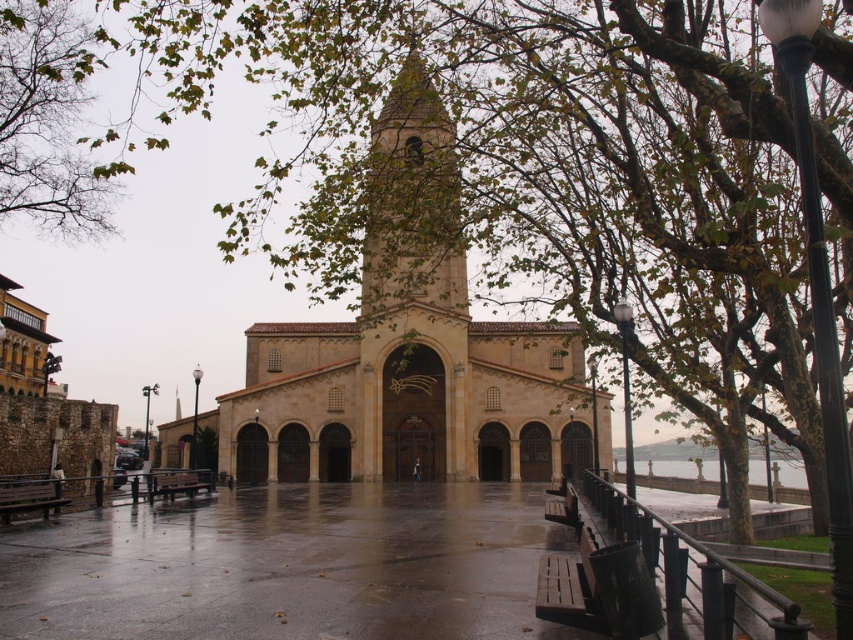
Does green leafy branches at upper left have a greater width compared to brown wooden bench at lower left?

Yes.

Is point (54, 35) in front of point (136, 480)?

No, (54, 35) is further to viewer.

Locate an element on the screen. green leafy branches at upper left is located at coordinates (47, 118).

Does wooden park bench at lower right have a lesser width compared to brown wooden bench at lower left?

Correct, wooden park bench at lower right's width is less than brown wooden bench at lower left's.

Does wooden park bench at lower right appear on the right side of brown wooden bench at lower left?

Correct, you'll find wooden park bench at lower right to the right of brown wooden bench at lower left.

Which is in front, point (572, 589) or point (177, 470)?

Point (572, 589)

The width and height of the screenshot is (853, 640). In order to click on wooden park bench at lower right in this screenshot , I will do `click(599, 589)`.

Is beige stone church at center further to camera compared to wooden bench at lower left?

Yes, it is.

Who is more distant from viewer, [444,291] or [44,493]?

The point [444,291] is more distant.

Image resolution: width=853 pixels, height=640 pixels. I want to click on beige stone church at center, so click(x=410, y=346).